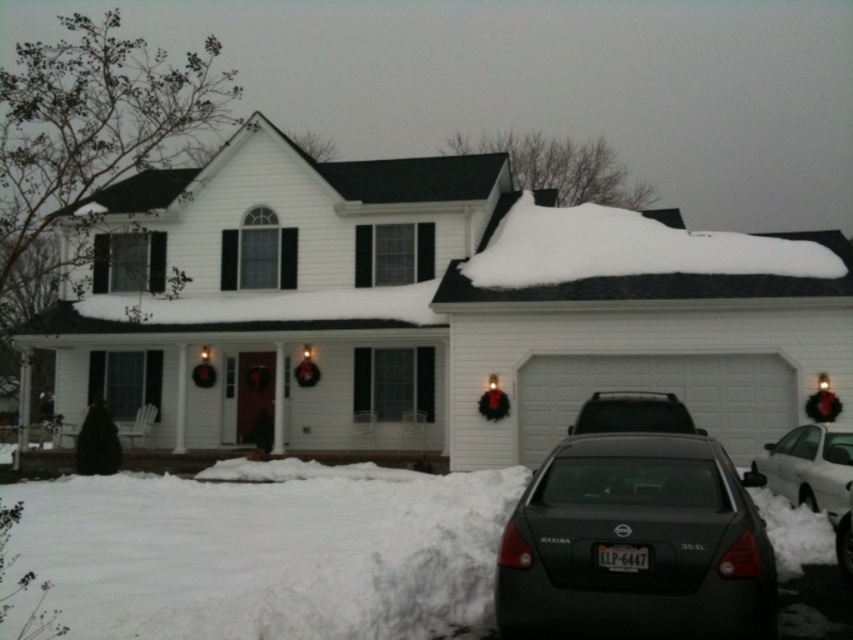
Is point (663, 259) closer to camera compared to point (805, 481)?

No, it is not.

Which is below, white fluffy snow at upper right or white glossy sedan at lower right?

white glossy sedan at lower right

The height and width of the screenshot is (640, 853). What do you see at coordinates (628, 250) in the screenshot?
I see `white fluffy snow at upper right` at bounding box center [628, 250].

Identify the location of white fluffy snow at upper right. The height and width of the screenshot is (640, 853). (628, 250).

Between matte black sedan at lower right and matte black suv at center, which one is positioned lower?

matte black sedan at lower right is lower down.

Can you confirm if matte black sedan at lower right is thinner than matte black suv at center?

No.

Image resolution: width=853 pixels, height=640 pixels. I want to click on matte black sedan at lower right, so click(x=635, y=545).

Is the position of matte black sedan at lower right less distant than that of dark gray metallic sedan at lower center?

Yes.

Does matte black sedan at lower right appear on the left side of dark gray metallic sedan at lower center?

Yes, matte black sedan at lower right is to the left of dark gray metallic sedan at lower center.

What do you see at coordinates (635, 545) in the screenshot? I see `matte black sedan at lower right` at bounding box center [635, 545].

The width and height of the screenshot is (853, 640). In order to click on matte black sedan at lower right in this screenshot , I will do `click(635, 545)`.